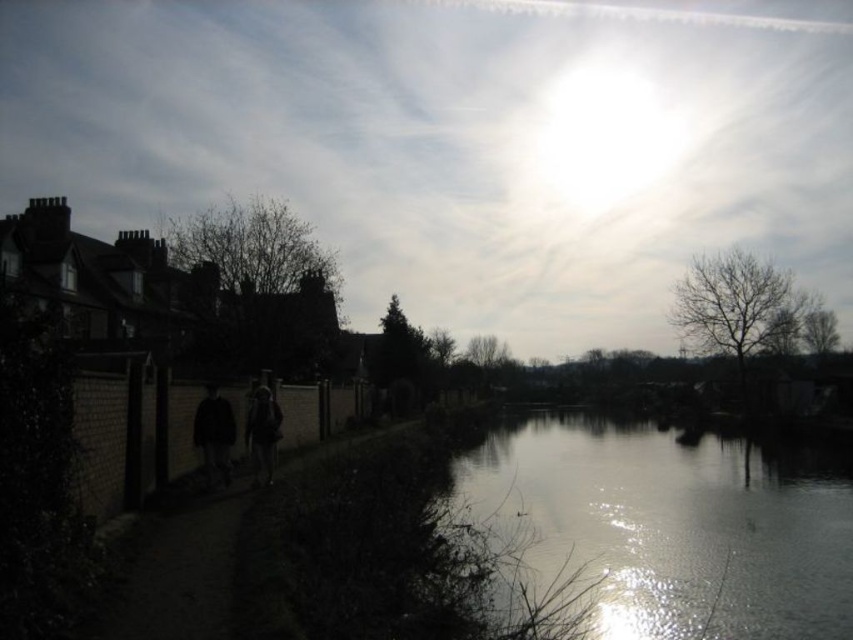
Question: Which object appears closest to the camera in this image?

Choices:
 (A) dark matte clothing at center
 (B) silvery reflective water at center
 (C) dark dirt path at lower left
 (D) dark fabric jacket at center

Answer: (C)

Question: Can you confirm if dark dirt path at lower left is smaller than dark fabric jacket at center?

Choices:
 (A) no
 (B) yes

Answer: (B)

Question: Which object appears farthest from the camera in this image?

Choices:
 (A) dark matte clothing at center
 (B) silvery reflective water at center
 (C) dark dirt path at lower left
 (D) dark fabric jacket at center

Answer: (D)

Question: Considering the real-world distances, which object is closest to the dark matte clothing at center?

Choices:
 (A) dark fabric jacket at center
 (B) dark dirt path at lower left
 (C) silvery reflective water at center

Answer: (A)

Question: Does silvery reflective water at center have a greater width compared to dark dirt path at lower left?

Choices:
 (A) no
 (B) yes

Answer: (B)

Question: Can you confirm if dark dirt path at lower left is wider than dark fabric jacket at center?

Choices:
 (A) no
 (B) yes

Answer: (B)